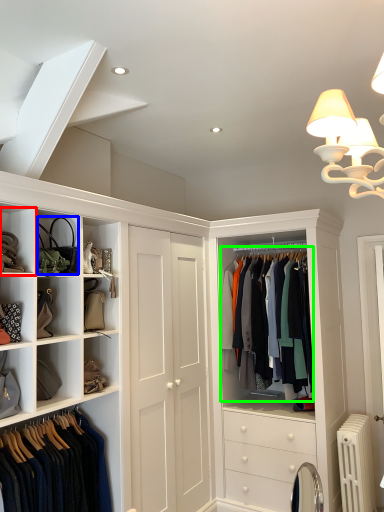
Question: Which is farther away from cabinet (highlighted by a red box)? accessory (highlighted by a blue box) or clothing (highlighted by a green box)?

Choices:
 (A) accessory
 (B) clothing

Answer: (B)